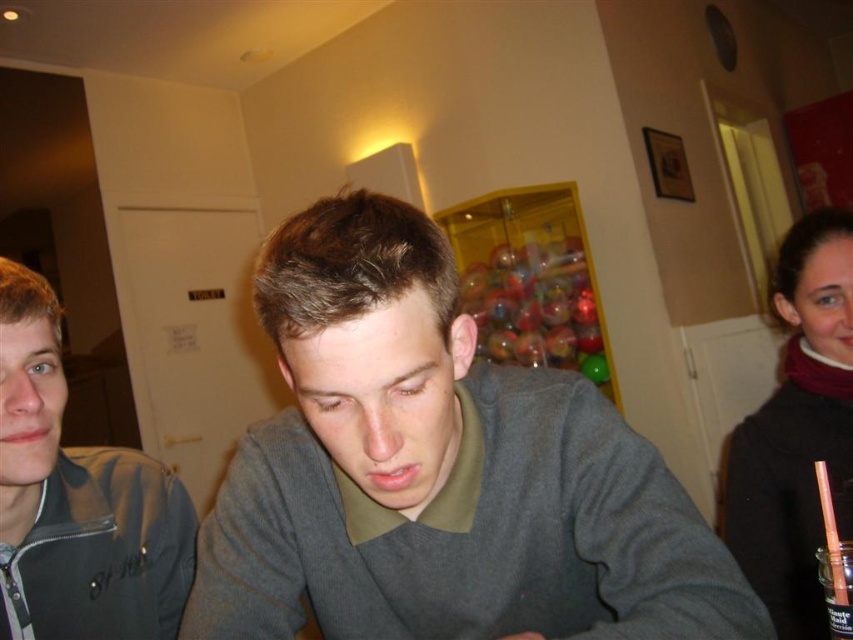
Can you confirm if gray zip-up jacket at left is thinner than velvet maroon scarf at right?

Yes.

Is gray zip-up jacket at left above velvet maroon scarf at right?

Incorrect, gray zip-up jacket at left is not positioned above velvet maroon scarf at right.

This screenshot has width=853, height=640. I want to click on gray zip-up jacket at left, so click(76, 500).

Does gray matte sweater at center have a greater width compared to gray zip-up jacket at left?

Correct, the width of gray matte sweater at center exceeds that of gray zip-up jacket at left.

Which is in front, point (767, 630) or point (82, 493)?

Point (767, 630) is more forward.

Identify the location of gray matte sweater at center. The image size is (853, 640). (439, 472).

Is gray matte sweater at center positioned in front of velvet maroon scarf at right?

Yes, gray matte sweater at center is in front of velvet maroon scarf at right.

Which of these two, gray matte sweater at center or velvet maroon scarf at right, stands taller?

velvet maroon scarf at right is taller.

Find the location of a particular element. Image resolution: width=853 pixels, height=640 pixels. gray matte sweater at center is located at coordinates (439, 472).

Where is `gray matte sweater at center`? gray matte sweater at center is located at coordinates (439, 472).